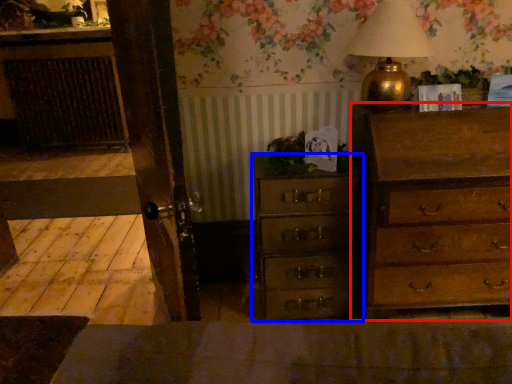
Question: Which of the following is the farthest to the observer, chest of drawers (highlighted by a red box) or chest of drawers (highlighted by a blue box)?

Choices:
 (A) chest of drawers
 (B) chest of drawers

Answer: (B)